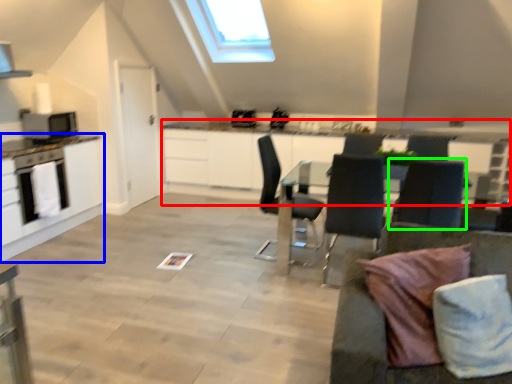
Question: Which object is positioned farthest from counter (highlighted by a red box)? Select from cabinetry (highlighted by a blue box) and chair (highlighted by a green box).

Choices:
 (A) cabinetry
 (B) chair

Answer: (B)